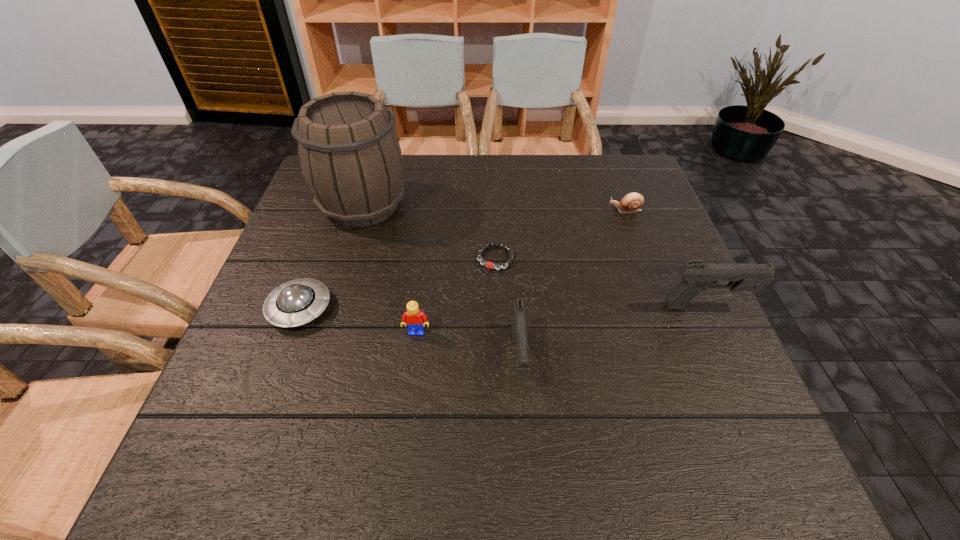
I want to click on free space between the bracelet and the escargot, so click(x=560, y=234).

Identify the location of blank region between the saucer and the farther pistol. This screenshot has width=960, height=540. (503, 307).

Locate an element on the screen. The height and width of the screenshot is (540, 960). vacant region between the farther pistol and the shorter pistol is located at coordinates (612, 333).

Identify the location of vacant area between the saucer and the fifth object from right to left. (358, 320).

Where is `free space between the third farthest object and the wine bucket`? This screenshot has width=960, height=540. free space between the third farthest object and the wine bucket is located at coordinates pyautogui.click(x=429, y=232).

Where is `vacant area that lies between the farther pistol and the escargot`? vacant area that lies between the farther pistol and the escargot is located at coordinates (666, 258).

Locate an element on the screen. The width and height of the screenshot is (960, 540). vacant space in between the saucer and the second tallest object is located at coordinates click(503, 307).

Identify the location of vacant space that's between the saucer and the third object from left to right. This screenshot has height=540, width=960. (358, 320).

Find the location of a particular element. Image resolution: width=960 pixels, height=540 pixels. free spot between the escargot and the left pistol is located at coordinates (572, 285).

Identify which object is the fourth nearest to the taller pistol. Please provide its 2D coordinates. Your answer should be formatted as a tuple, i.e. [(x, y)], where the tuple contains the x and y coordinates of a point satisfying the conditions above.

[(414, 318)]